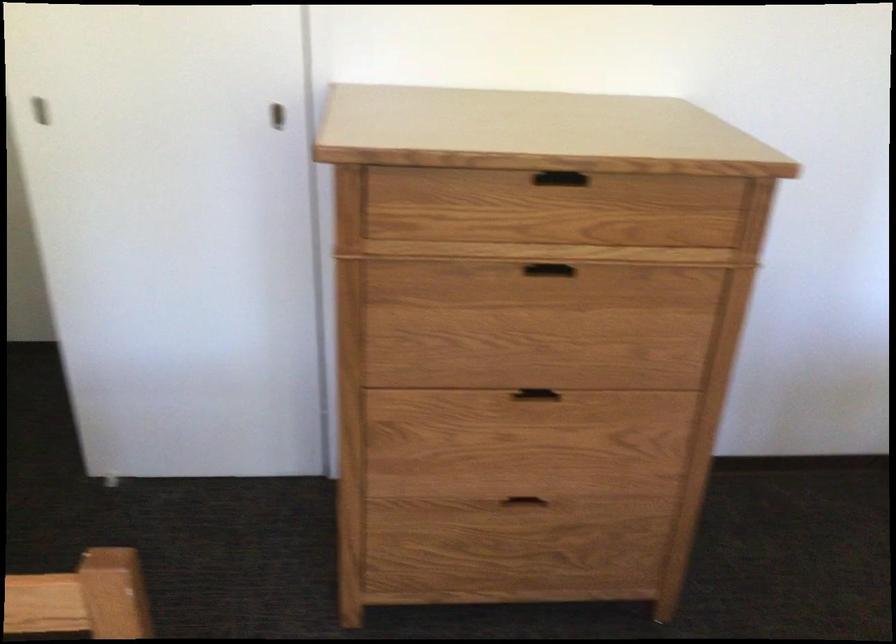
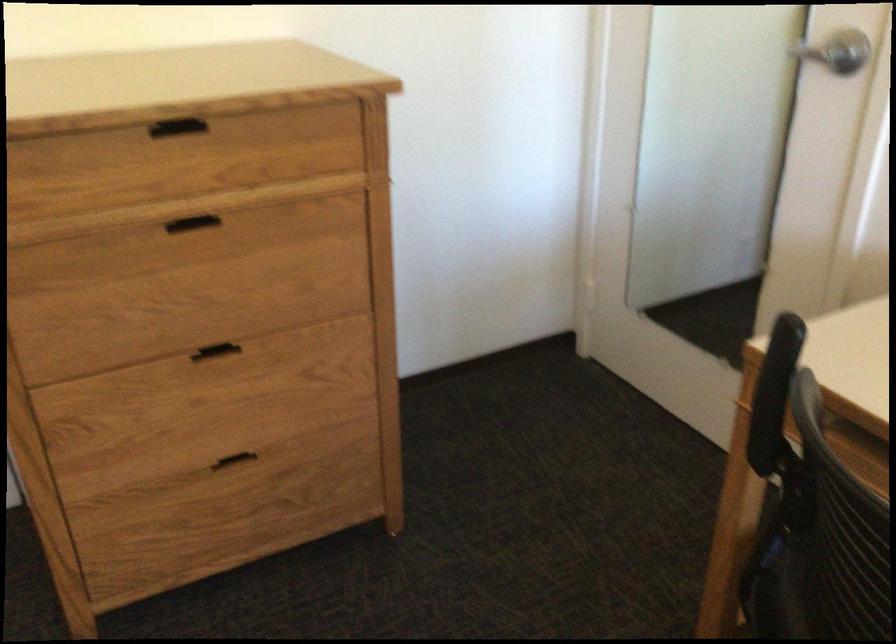
Where in the second image is the point corresponding to the point at 537,393 from the first image?

(214, 352)